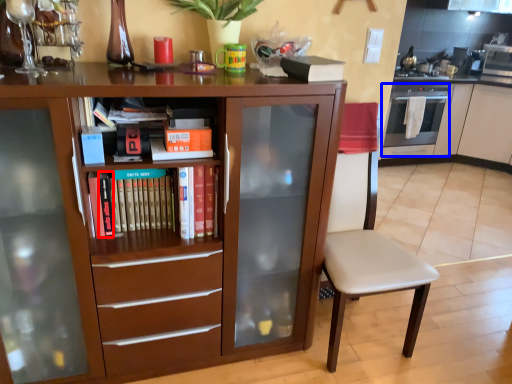
Question: Which object appears farthest to the camera in this image, paperback book (highlighted by a red box) or oven (highlighted by a blue box)?

Choices:
 (A) paperback book
 (B) oven

Answer: (B)